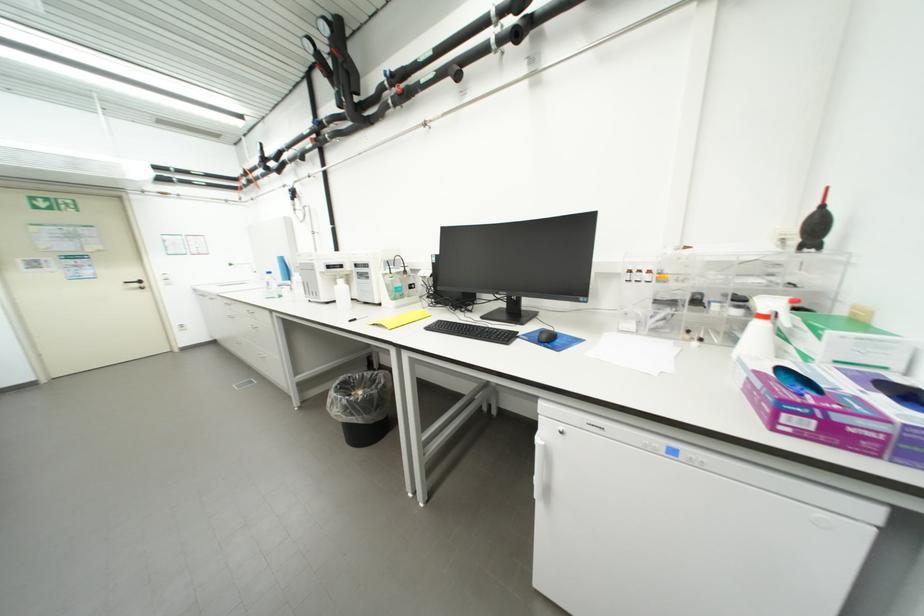
What do you see at coordinates (357, 318) in the screenshot?
I see `a black pen` at bounding box center [357, 318].